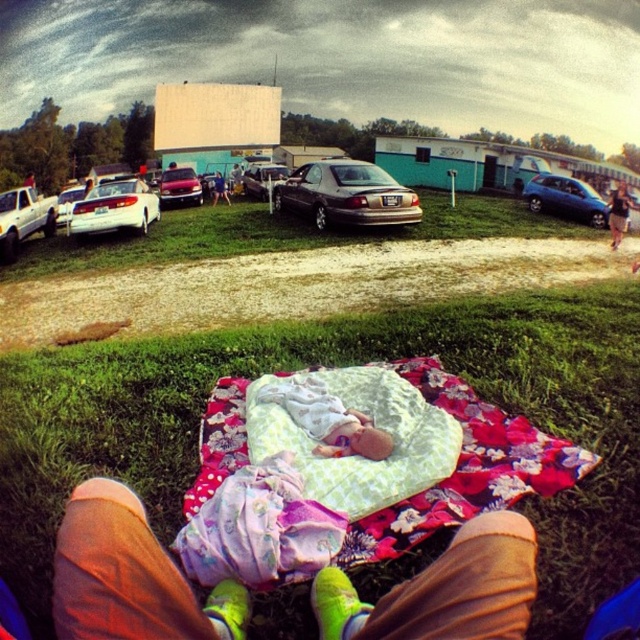
You are a photographer at the drive in theater and you want to take a photo of the white glossy sedan at center and the smooth leather jacket at center. Which object should you focus on first if you want to capture both in the same frame without moving the camera?

The white glossy sedan at center is located below the smooth leather jacket at center, so you should focus on the smooth leather jacket at center first to ensure both are in the frame.

You are a parking attendant at the drive in theater. You need to fit a new car that is 1.6 meters tall into the parking space between the blue metallic hatchback at right and the shiny silver sedan at center. Can the new car fit vertically between them?

The blue metallic hatchback at right is taller than the shiny silver sedan at center. Since the new car is 1.6 meters tall, and the height difference between the two existing cars isn not specified, it is possible that the space between them could accommodate the new car. However, without knowing the exact height of the shiny silver sedan at center, we cannot definitively confirm if the 1.6 meter tall car will fit vertically between them.

You are a parking attendant at the drive in theater. You need to park a new car that is exactly the same width as the smooth leather jacket at center. Is there enough space between the white glossy sedan at center and the adjacent cars to fit the new car?

The white glossy sedan at center might be wider than the smooth leather jacket at center, so there might not be enough space to fit the new car of the same width as the smooth leather jacket at center between the white glossy sedan at center and the adjacent cars.